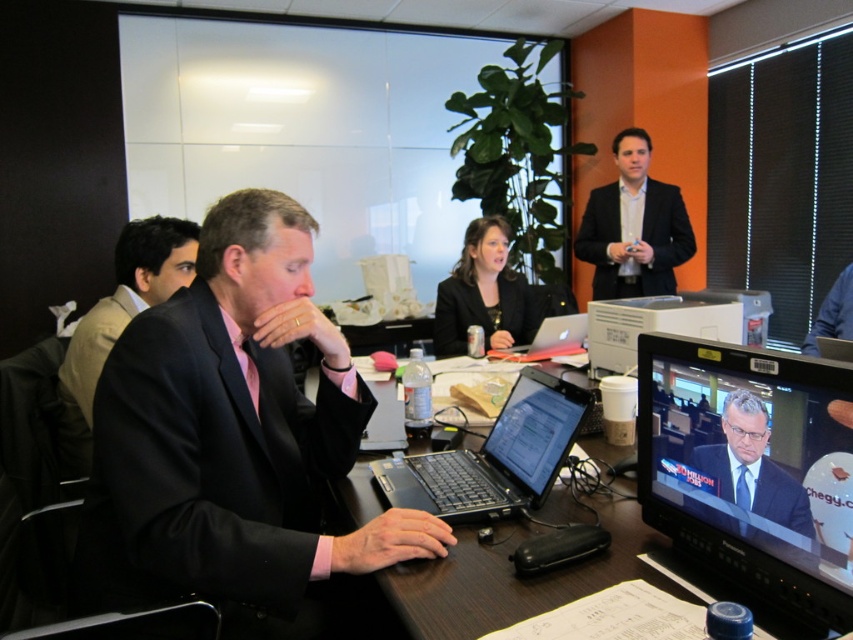
Is point (299, 518) farther from viewer compared to point (476, 260)?

No.

Between black matte suit at center and black matte jacket at center, which one appears on the left side from the viewer's perspective?

black matte suit at center is more to the left.

Image resolution: width=853 pixels, height=640 pixels. What are the coordinates of `black matte suit at center` in the screenshot? It's located at (212, 474).

Is black plastic laptop at center bigger than dark blue suit at center?

Yes, black plastic laptop at center is bigger than dark blue suit at center.

In the scene shown: Who is shorter, black plastic laptop at center or dark blue suit at center?

With less height is dark blue suit at center.

Which is behind, point (457, 513) or point (724, 480)?

The point (457, 513) is more distant.

Identify the location of black plastic laptop at center. Image resolution: width=853 pixels, height=640 pixels. (492, 458).

Which is more to the left, black matte suit at center or black glossy monitor at right?

black matte suit at center

Does point (199, 294) come closer to viewer compared to point (666, 486)?

No, (199, 294) is behind (666, 486).

Which is behind, point (276, 499) or point (790, 374)?

Point (276, 499)

Where is `black matte suit at center`? The image size is (853, 640). black matte suit at center is located at coordinates (212, 474).